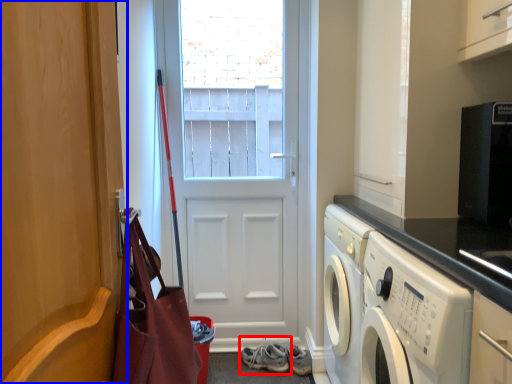
Question: Which point is further to the camera, footwear (highlighted by a red box) or door (highlighted by a blue box)?

Choices:
 (A) footwear
 (B) door

Answer: (A)